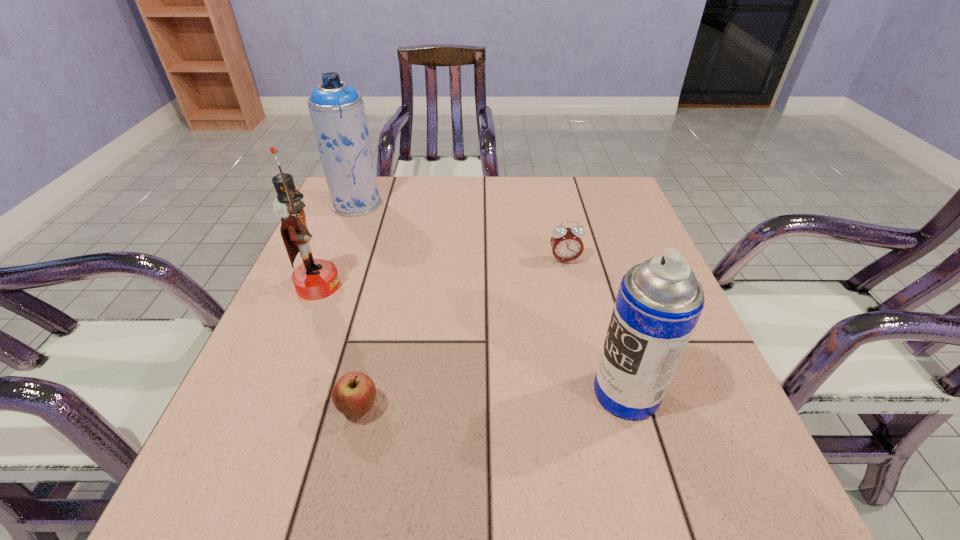
Where is `vacant space positioned 0.080m on the label side of the right aerosol can`? Image resolution: width=960 pixels, height=540 pixels. vacant space positioned 0.080m on the label side of the right aerosol can is located at coordinates (546, 393).

This screenshot has height=540, width=960. What are the coordinates of `vacant space situated 0.140m on the label side of the right aerosol can` in the screenshot? It's located at (511, 393).

Where is `vacant space positioned 0.330m on the label side of the right aerosol can`? vacant space positioned 0.330m on the label side of the right aerosol can is located at coordinates (398, 393).

Find the location of a particular element. vacant area situated 0.300m on the clock face of the fourth nearest object is located at coordinates (590, 374).

Identify the location of free space located 0.170m on the left of the shortest object. This screenshot has width=960, height=540. (234, 409).

Image resolution: width=960 pixels, height=540 pixels. I want to click on object at the far edge, so click(x=337, y=111).

This screenshot has height=540, width=960. I want to click on aerosol can that is at the left edge, so click(x=337, y=111).

This screenshot has height=540, width=960. Find the location of `nutcracker that is at the left edge`. nutcracker that is at the left edge is located at coordinates (314, 279).

Find the location of a particular element. This screenshot has height=540, width=960. object that is positioned at the right edge is located at coordinates tap(659, 302).

Find the location of a particular element. object that is at the far left corner is located at coordinates (337, 111).